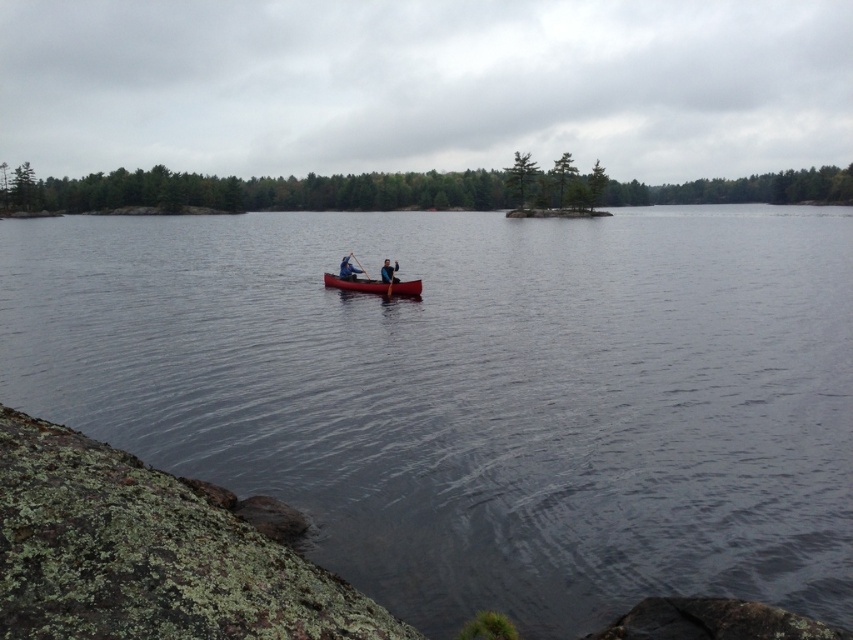
Question: Observing the image, what is the correct spatial positioning of dark gray water at center in reference to blue fabric jacket at center?

Choices:
 (A) above
 (B) below

Answer: (A)

Question: Can you confirm if blue fabric jacket at center is bigger than blue fabric person at center?

Choices:
 (A) yes
 (B) no

Answer: (A)

Question: Does dark gray water at center have a lesser width compared to matte red canoe at center?

Choices:
 (A) yes
 (B) no

Answer: (B)

Question: Which is farther from the matte red canoe at center?

Choices:
 (A) wooden paddle at center
 (B) blue fabric jacket at center

Answer: (A)

Question: Which of the following is the closest to the observer?

Choices:
 (A) (804, 228)
 (B) (390, 273)
 (C) (357, 268)

Answer: (B)

Question: Which point is closer to the camera taking this photo?

Choices:
 (A) (339, 273)
 (B) (352, 284)
 (C) (445, 577)
 (D) (358, 268)

Answer: (C)